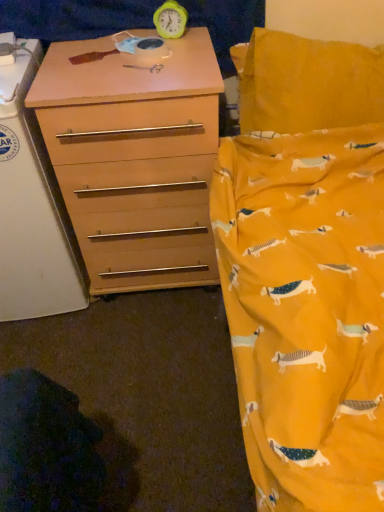
You are a GUI agent. You are given a task and a screenshot of the screen. Output one action in this format:
    pyautogui.click(x=<x>, y=<y>)
    Task: Click on the space that is in front of green plastic clock at upper center
    The width and height of the screenshot is (384, 512).
    Given the screenshot: What is the action you would take?
    pyautogui.click(x=173, y=54)